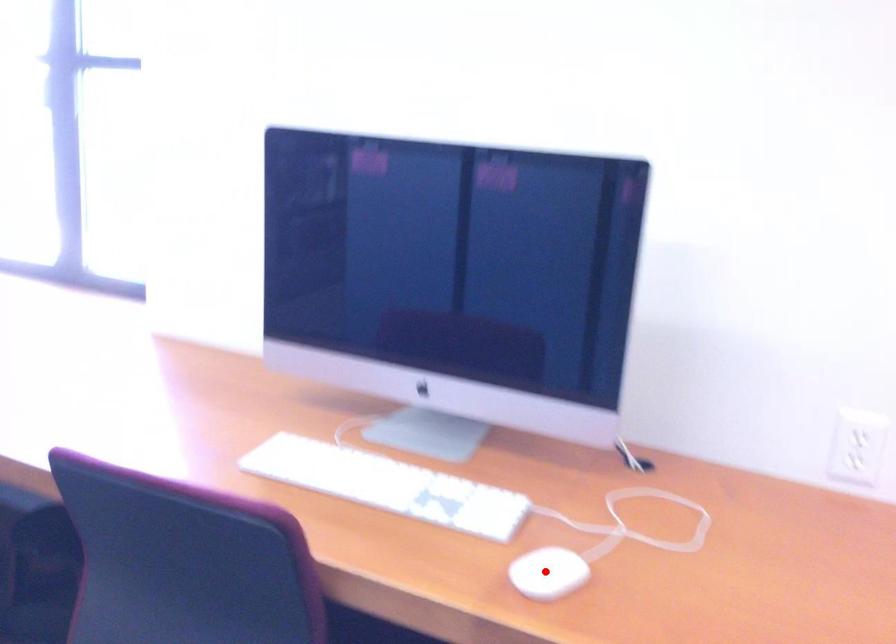
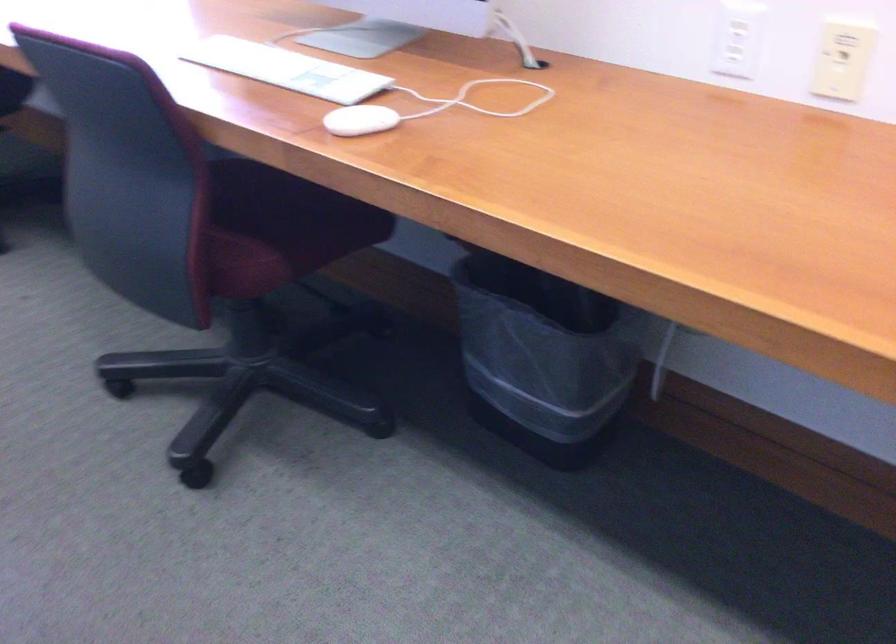
Question: A red point is marked in image1. In image2, is the corresponding 3D point closer to the camera or farther? Reply with the corresponding letter.

Choices:
 (A) The corresponding 3D point is closer.
 (B) The corresponding 3D point is farther.

Answer: (B)